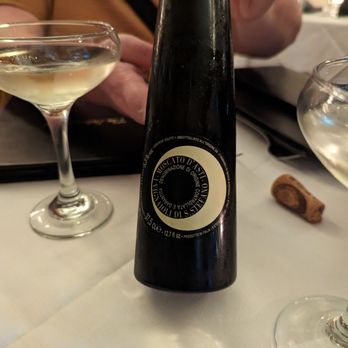
What are the coordinates of `bottle` in the screenshot? It's located at (213, 209).